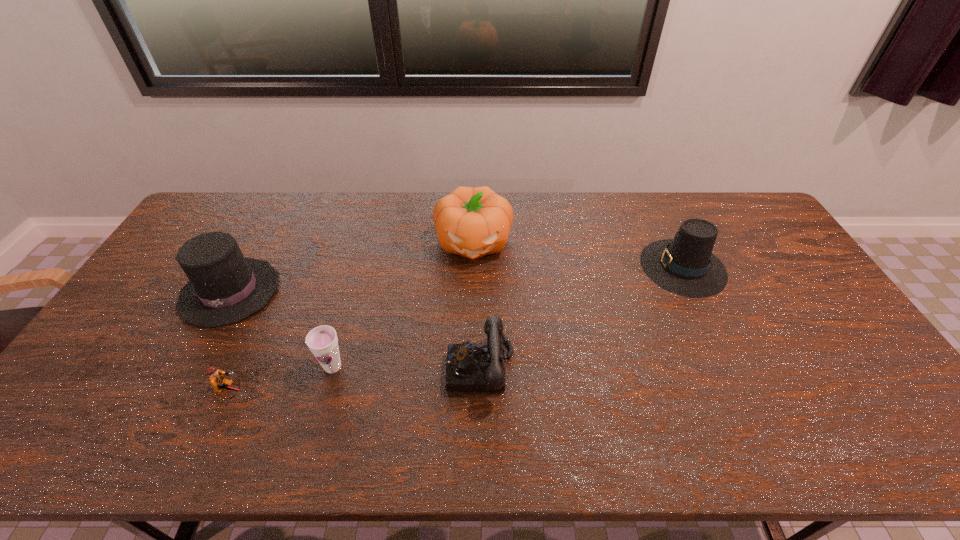
This screenshot has width=960, height=540. Identify the location of pumpkin. (472, 222).

Identify the location of the left hat. The image size is (960, 540). (224, 288).

This screenshot has width=960, height=540. What are the coordinates of `the right hat` in the screenshot? It's located at (685, 265).

At what (x,y) coordinates should I click in order to perform the action: click on telephone. Please return your answer as a coordinate pair (x, y). Looking at the image, I should click on (470, 367).

Where is `cup`? The height and width of the screenshot is (540, 960). cup is located at coordinates (322, 341).

At what (x,y) coordinates should I click in order to perform the action: click on the shortest object. Please return your answer as a coordinate pair (x, y). Image resolution: width=960 pixels, height=540 pixels. Looking at the image, I should click on (217, 378).

You are a GUI agent. You are given a task and a screenshot of the screen. Output one action in this format:
    pyautogui.click(x=<x>, y=<y>)
    Task: Click on the free location located on the carved face of the pumpkin
    The width and height of the screenshot is (960, 540).
    Given the screenshot: What is the action you would take?
    pyautogui.click(x=472, y=298)

What are the coordinates of `vacant area located 0.130m on the front of the left hat with the decoration` in the screenshot? It's located at (187, 369).

At what (x,y) coordinates should I click in order to perform the action: click on blank area located on the front-facing side of the rightmost object. Please return your answer as a coordinate pair (x, y). Looking at the image, I should click on (572, 267).

Identify the location of vacant region located 0.320m on the front-facing side of the rightmost object. (541, 267).